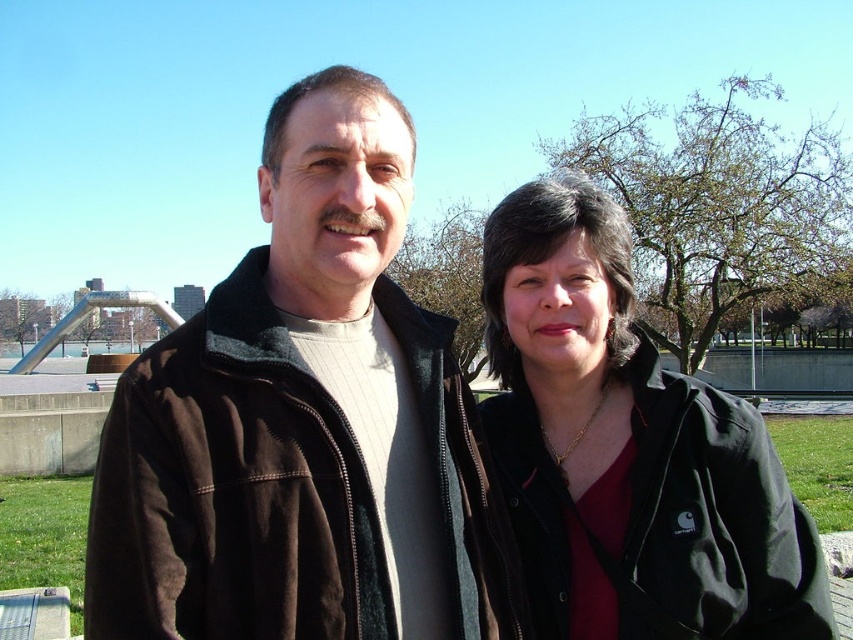
Looking at this image, you are trying to decide which jacket to wear based on the image. The brown fleece jacket at center and the black matte jacket at center are both in your size. However, you prefer a jacket that reaches below your waist. Which one should you choose?

The black matte jacket at center is taller than the brown fleece jacket at center, so you should choose the black matte jacket at center since it reaches below your waist.